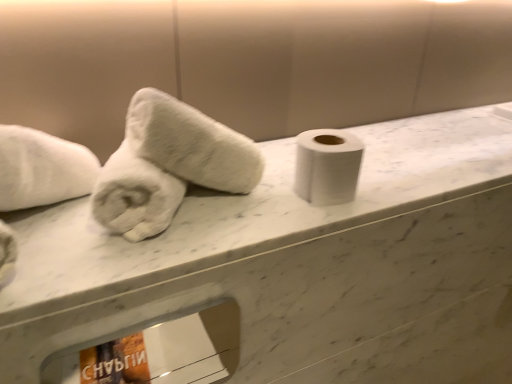
What are the coordinates of `free spot to the right of white fluffy towel at left, positioned as the 2th towel in left-to-right order` in the screenshot? It's located at (288, 198).